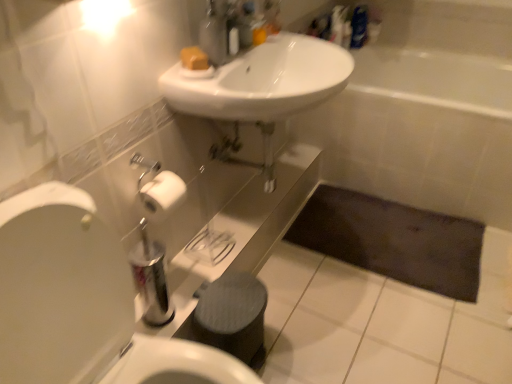
Measure the distance between matte plastic soap dispenser at upper center and camera.

6.95 feet.

What do you see at coordinates (346, 34) in the screenshot?
I see `matte plastic soap dispenser at upper center` at bounding box center [346, 34].

Identify the location of white glossy sink at upper center. (261, 87).

Where is `white glossy toilet at left`? The image size is (512, 384). white glossy toilet at left is located at coordinates (82, 303).

At what (x,y) coordinates should I click in order to perform the action: click on soap that appears behind the white glossy sink at upper center. Please return your answer as a coordinate pair (x, y). Looking at the image, I should click on (194, 58).

Is white glossy sink at upper center at the back of yellow matte soap at upper center?

No, yellow matte soap at upper center's orientation is not away from white glossy sink at upper center.

Would you say dark fabric bath mat at lower center is part of white ceramic bathtub at center's contents?

No, dark fabric bath mat at lower center is located outside of white ceramic bathtub at center.

Is white ceramic bathtub at center positioned with its back to dark fabric bath mat at lower center?

white ceramic bathtub at center does not have its back to dark fabric bath mat at lower center.

Consider the image. From a real-world perspective, is white ceramic bathtub at center on top of dark fabric bath mat at lower center?

Indeed, from a real-world perspective, white ceramic bathtub at center stands above dark fabric bath mat at lower center.

Considering the positions of objects white ceramic bathtub at center and dark fabric bath mat at lower center in the image provided, who is more to the right, white ceramic bathtub at center or dark fabric bath mat at lower center?

white ceramic bathtub at center is more to the right.

Based on the photo, can you tell me how much white glossy sink at center and white glossy toilet at left differ in facing direction?

The angular difference between white glossy sink at center and white glossy toilet at left is 3.6 degrees.

From a real-world perspective, which object rests below the other?

white glossy toilet at left.

Between white glossy sink at center and white glossy toilet at left, which one has less height?

white glossy sink at center.

Is there a large distance between white glossy sink at center and white glossy toilet at left?

No, white glossy sink at center is not far from white glossy toilet at left.

From the image's perspective, which is below, white glossy sink at upper center or yellow matte soap at upper center?

white glossy sink at upper center appears lower in the image.

Is white glossy sink at upper center shorter than yellow matte soap at upper center?

Incorrect, the height of white glossy sink at upper center does not fall short of that of yellow matte soap at upper center.

This screenshot has height=384, width=512. I want to click on soap behind the white glossy sink at upper center, so click(194, 58).

Can you confirm if white glossy sink at upper center is thinner than yellow matte soap at upper center?

In fact, white glossy sink at upper center might be wider than yellow matte soap at upper center.

Does dark fabric bath mat at lower center have a lesser width compared to white glossy sink at center?

No.

Which of these two, dark fabric bath mat at lower center or white glossy sink at center, stands taller?

Standing taller between the two is white glossy sink at center.

At what (x,y) coordinates should I click in order to perform the action: click on bath mat that appears behind the white glossy sink at center. Please return your answer as a coordinate pair (x, y). The image size is (512, 384). Looking at the image, I should click on (393, 240).

From the image's perspective, which is below, dark fabric bath mat at lower center or white glossy sink at center?

dark fabric bath mat at lower center is shown below in the image.

Considering the sizes of objects white ceramic bathtub at center and white glossy sink at upper center in the image provided, who is smaller, white ceramic bathtub at center or white glossy sink at upper center?

With smaller size is white glossy sink at upper center.

Is white glossy sink at upper center surrounded by white ceramic bathtub at center?

That's incorrect, white glossy sink at upper center is not inside white ceramic bathtub at center.

Is dark fabric bath mat at lower center closer to camera compared to white glossy sink at upper center?

No, it is not.

From the image's perspective, is dark fabric bath mat at lower center above or below white glossy sink at upper center?

dark fabric bath mat at lower center is below white glossy sink at upper center.

Considering the points (404, 274) and (309, 98), which point is in front, point (404, 274) or point (309, 98)?

Positioned in front is point (309, 98).

Which object is thinner, dark fabric bath mat at lower center or white glossy sink at upper center?

white glossy sink at upper center.

The image size is (512, 384). Identify the location of sink that is below the yellow matte soap at upper center (from the image's perspective). (261, 87).

Where is `bath in front of the dark fabric bath mat at lower center`? bath in front of the dark fabric bath mat at lower center is located at coordinates (426, 111).

Considering their positions, is white ceramic bathtub at center positioned further to matte plastic soap dispenser at upper center than yellow matte soap at upper center?

yellow matte soap at upper center lies further to matte plastic soap dispenser at upper center than the other object.

From the image, which object appears to be farther from white glossy sink at center, white glossy sink at upper center or dark fabric bath mat at lower center?

The object further to white glossy sink at center is dark fabric bath mat at lower center.

Based on the photo, estimate the real-world distances between objects in this image. Which object is closer to dark fabric bath mat at lower center, white glossy toilet at left or white glossy sink at center?

Based on the image, white glossy sink at center appears to be nearer to dark fabric bath mat at lower center.

Looking at the image, which one is located closer to white ceramic bathtub at center, white glossy toilet at left or matte plastic soap dispenser at upper center?

matte plastic soap dispenser at upper center.

When comparing their distances from matte plastic soap dispenser at upper center, does yellow matte soap at upper center or white glossy sink at center seem closer?

white glossy sink at center is positioned closer to the anchor matte plastic soap dispenser at upper center.

Based on their spatial positions, is yellow matte soap at upper center or matte plastic soap dispenser at upper center closer to white glossy sink at upper center?

yellow matte soap at upper center.

Based on their spatial positions, is white glossy toilet at left or dark fabric bath mat at lower center closer to yellow matte soap at upper center?

white glossy toilet at left.

Looking at this image, from the image, which object appears to be nearer to white glossy toilet at left, white glossy sink at upper center or white ceramic bathtub at center?

white glossy sink at upper center.

Identify the location of bath between white glossy sink at upper center and matte plastic soap dispenser at upper center along the z-axis. This screenshot has width=512, height=384. (426, 111).

Image resolution: width=512 pixels, height=384 pixels. Find the location of `bath mat situated between yellow matte soap at upper center and white ceramic bathtub at center from left to right`. bath mat situated between yellow matte soap at upper center and white ceramic bathtub at center from left to right is located at coordinates (393, 240).

At what (x,y) coordinates should I click in order to perform the action: click on bath positioned between white glossy sink at center and matte plastic soap dispenser at upper center from near to far. Please return your answer as a coordinate pair (x, y). The height and width of the screenshot is (384, 512). Looking at the image, I should click on (426, 111).

Locate an element on the screen. sink between white glossy sink at center and dark fabric bath mat at lower center is located at coordinates (261, 87).